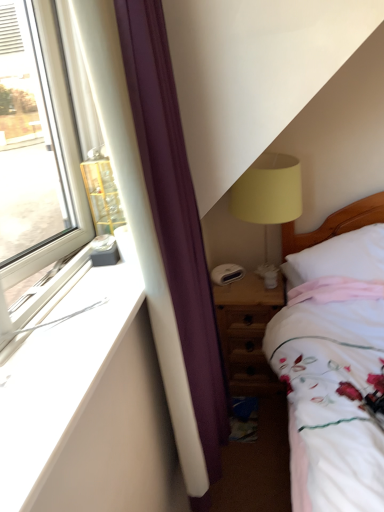
The height and width of the screenshot is (512, 384). I want to click on white soft pillow at right, so click(340, 257).

This screenshot has width=384, height=512. Describe the element at coordinates (247, 332) in the screenshot. I see `wooden nightstand at lower right` at that location.

What is the approximate width of matte yellow fabric lampshade at upper right?

The width of matte yellow fabric lampshade at upper right is 12.65 inches.

In order to face matte yellow fabric lampshade at upper right, should I rotate leftwards or rightwards?

To face it directly, rotate right by 10.216 degrees.

Locate an element on the screen. This screenshot has width=384, height=512. white smooth window sill at left is located at coordinates (59, 380).

This screenshot has height=512, width=384. In order to click on white soft pillow at right in this screenshot , I will do `click(340, 257)`.

Which of these two, wooden nightstand at lower right or white soft pillow at right, is smaller?

Smaller between the two is white soft pillow at right.

Looking at this image, is wooden nightstand at lower right completely or partially outside of white soft pillow at right?

Absolutely, wooden nightstand at lower right is external to white soft pillow at right.

Measure the distance from wooden nightstand at lower right to white soft pillow at right.

13.33 inches.

Is matte yellow fabric lampshade at upper right shorter than wooden nightstand at lower right?

Incorrect, the height of matte yellow fabric lampshade at upper right does not fall short of that of wooden nightstand at lower right.

The width and height of the screenshot is (384, 512). Find the location of `table lamp that is on the right side of wooden nightstand at lower right`. table lamp that is on the right side of wooden nightstand at lower right is located at coordinates (268, 198).

Is matte yellow fabric lampshade at upper right in contact with wooden nightstand at lower right?

No.

In the scene shown: Does matte yellow fabric lampshade at upper right lie behind wooden nightstand at lower right?

No, matte yellow fabric lampshade at upper right is in front of wooden nightstand at lower right.

Which is closer, (249,187) or (80,361)?

Point (249,187) is farther from the camera than point (80,361).

Would you say matte yellow fabric lampshade at upper right is outside white smooth window sill at left?

Yes.

Which object is wider, matte yellow fabric lampshade at upper right or white smooth window sill at left?

Wider between the two is matte yellow fabric lampshade at upper right.

Considering the sizes of objects matte yellow fabric lampshade at upper right and white smooth window sill at left in the image provided, who is taller, matte yellow fabric lampshade at upper right or white smooth window sill at left?

With more height is matte yellow fabric lampshade at upper right.

Which object is positioned more to the left, matte yellow fabric lampshade at upper right or white soft pillow at right?

matte yellow fabric lampshade at upper right.

Identify the location of pillow below the matte yellow fabric lampshade at upper right (from a real-world perspective). The image size is (384, 512). (340, 257).

Is matte yellow fabric lampshade at upper right aimed at white soft pillow at right?

No, matte yellow fabric lampshade at upper right is not aimed at white soft pillow at right.

Consider the image. Which is closer to the camera, (276, 216) or (364, 227)?

Point (276, 216) appears to be closer to the viewer than point (364, 227).

Does wooden nightstand at lower right appear on the left side of matte yellow fabric lampshade at upper right?

Correct, you'll find wooden nightstand at lower right to the left of matte yellow fabric lampshade at upper right.

Would you say wooden nightstand at lower right is a long distance from matte yellow fabric lampshade at upper right?

No, wooden nightstand at lower right is not far away from matte yellow fabric lampshade at upper right.

Is matte yellow fabric lampshade at upper right located within wooden nightstand at lower right?

No, matte yellow fabric lampshade at upper right is not surrounded by wooden nightstand at lower right.

From a real-world perspective, which object stands above the other?

matte yellow fabric lampshade at upper right is physically above.

From the image's perspective, which object appears higher, white smooth window sill at left or white soft pillow at right?

white soft pillow at right, from the image's perspective.

Considering the sizes of objects white smooth window sill at left and white soft pillow at right in the image provided, who is taller, white smooth window sill at left or white soft pillow at right?

With more height is white soft pillow at right.

Can you confirm if white smooth window sill at left is positioned to the left of white soft pillow at right?

Yes, white smooth window sill at left is to the left of white soft pillow at right.

Does white smooth window sill at left come in front of white soft pillow at right?

That is True.

From the image's perspective, who appears lower, white soft pillow at right or matte yellow fabric lampshade at upper right?

white soft pillow at right, from the image's perspective.

Between white soft pillow at right and matte yellow fabric lampshade at upper right, which one has larger width?

white soft pillow at right is wider.

Which of these two, white soft pillow at right or matte yellow fabric lampshade at upper right, stands taller?

matte yellow fabric lampshade at upper right.

In the image, there is a white soft pillow at right. Where is `nightstand below it (from the image's perspective)`? This screenshot has width=384, height=512. nightstand below it (from the image's perspective) is located at coordinates (247, 332).

Where is `table lamp above the wooden nightstand at lower right (from a real-world perspective)`? table lamp above the wooden nightstand at lower right (from a real-world perspective) is located at coordinates (268, 198).

Estimate the real-world distances between objects in this image. Which object is closer to white soft pillow at right, matte yellow fabric lampshade at upper right or wooden nightstand at lower right?

matte yellow fabric lampshade at upper right is positioned closer to the anchor white soft pillow at right.

In the scene shown: From the image, which object appears to be nearer to white smooth window sill at left, white soft pillow at right or wooden nightstand at lower right?

Based on the image, wooden nightstand at lower right appears to be nearer to white smooth window sill at left.

When comparing their distances from wooden nightstand at lower right, does matte yellow fabric lampshade at upper right or white smooth window sill at left seem closer?

Answer: matte yellow fabric lampshade at upper right lies closer to wooden nightstand at lower right than the other object.

Looking at the image, which one is located further to white smooth window sill at left, matte yellow fabric lampshade at upper right or wooden nightstand at lower right?

Based on the image, wooden nightstand at lower right appears to be further to white smooth window sill at left.

Considering their positions, is matte yellow fabric lampshade at upper right positioned closer to white smooth window sill at left than white soft pillow at right?

matte yellow fabric lampshade at upper right is closer to white smooth window sill at left.

Considering their positions, is wooden nightstand at lower right positioned further to white smooth window sill at left than white soft pillow at right?

white soft pillow at right is positioned further to the anchor white smooth window sill at left.

Considering their positions, is white smooth window sill at left positioned closer to matte yellow fabric lampshade at upper right than wooden nightstand at lower right?

wooden nightstand at lower right is positioned closer to the anchor matte yellow fabric lampshade at upper right.

From the picture: Which object lies further to the anchor point wooden nightstand at lower right, white smooth window sill at left or white soft pillow at right?

Among the two, white smooth window sill at left is located further to wooden nightstand at lower right.

The image size is (384, 512). I want to click on pillow between matte yellow fabric lampshade at upper right and wooden nightstand at lower right in the vertical direction, so click(x=340, y=257).

Locate an element on the screen. The width and height of the screenshot is (384, 512). pillow located between white smooth window sill at left and wooden nightstand at lower right in the depth direction is located at coordinates (340, 257).

Find the location of a particular element. table lamp between white smooth window sill at left and wooden nightstand at lower right from front to back is located at coordinates (268, 198).

Identify the location of pillow located between white smooth window sill at left and matte yellow fabric lampshade at upper right in the depth direction. This screenshot has height=512, width=384. (340, 257).